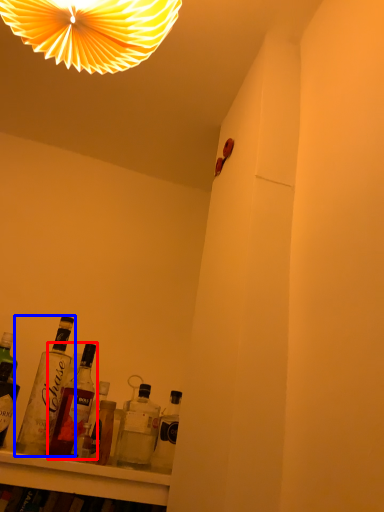
Question: Which point is further to the camera, bottle (highlighted by a red box) or bottle (highlighted by a blue box)?

Choices:
 (A) bottle
 (B) bottle

Answer: (A)